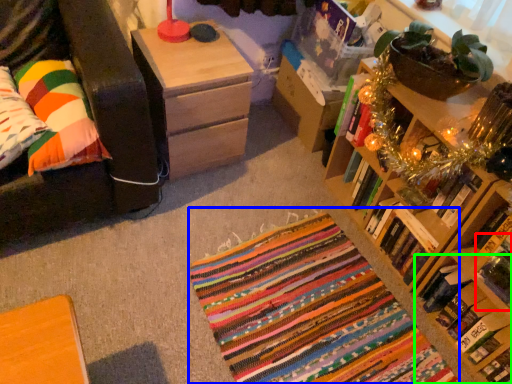
Question: Based on their relative distances, which object is farther from book (highlighted by a red box)? Choose from yoga mat (highlighted by a blue box) and book (highlighted by a green box).

Choices:
 (A) yoga mat
 (B) book

Answer: (A)